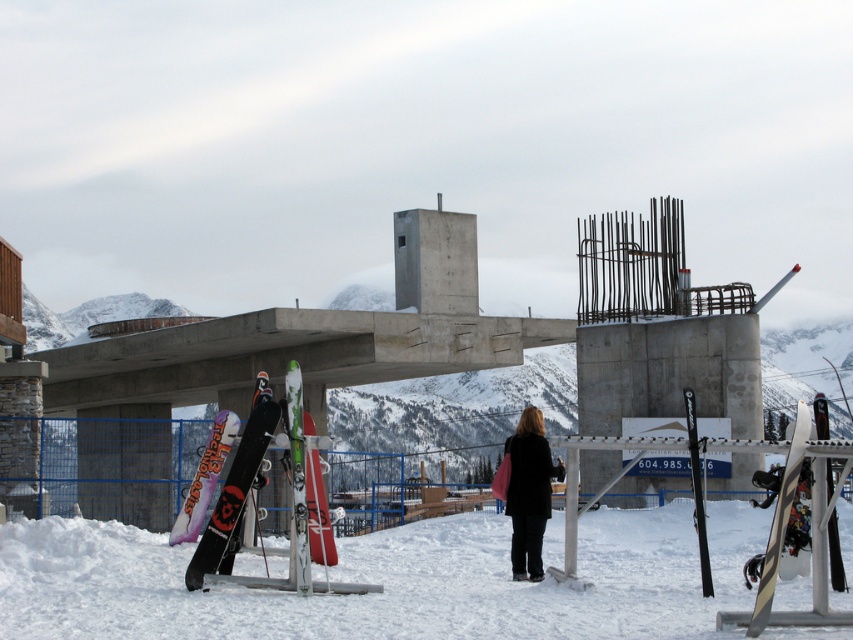
Is white snowboard at lower center bigger than black matte coat at center?

Indeed, white snowboard at lower center has a larger size compared to black matte coat at center.

You are a GUI agent. You are given a task and a screenshot of the screen. Output one action in this format:
    pyautogui.click(x=<x>, y=<y>)
    Task: Click on the white snowboard at lower center
    Image resolution: width=853 pixels, height=640 pixels.
    Given the screenshot: What is the action you would take?
    pyautogui.click(x=387, y=580)

The width and height of the screenshot is (853, 640). Identify the location of white snowboard at lower center. (387, 580).

Which is more to the left, matte black snowboard at left or matte red snowboard at center?

From the viewer's perspective, matte black snowboard at left appears more on the left side.

Between matte black snowboard at left and matte red snowboard at center, which one has less height?

With less height is matte red snowboard at center.

Locate an element on the screen. matte black snowboard at left is located at coordinates (206, 477).

Does black matte snowboard at lower left have a lesser width compared to matte black snowboard at left?

Yes.

Identify the location of black matte snowboard at lower left. (233, 497).